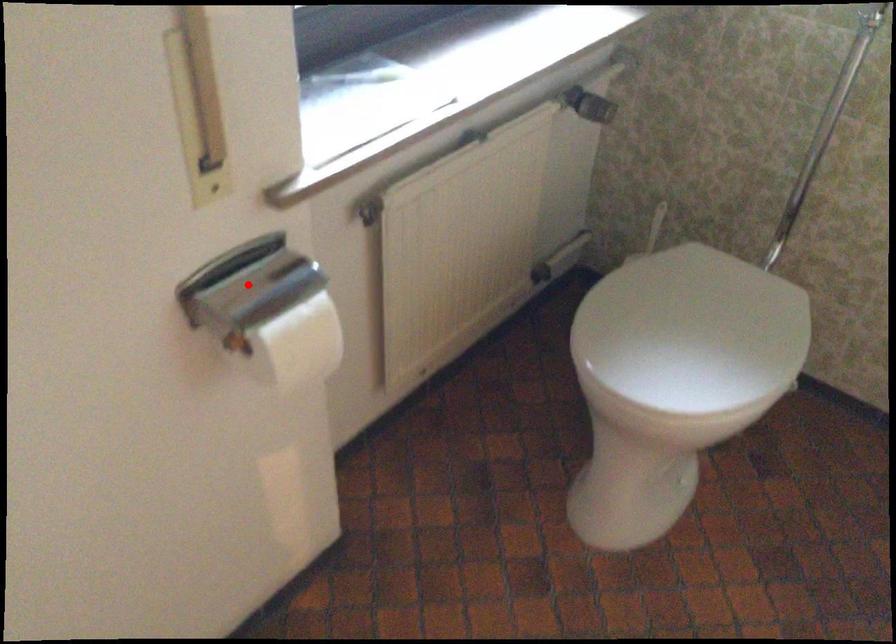
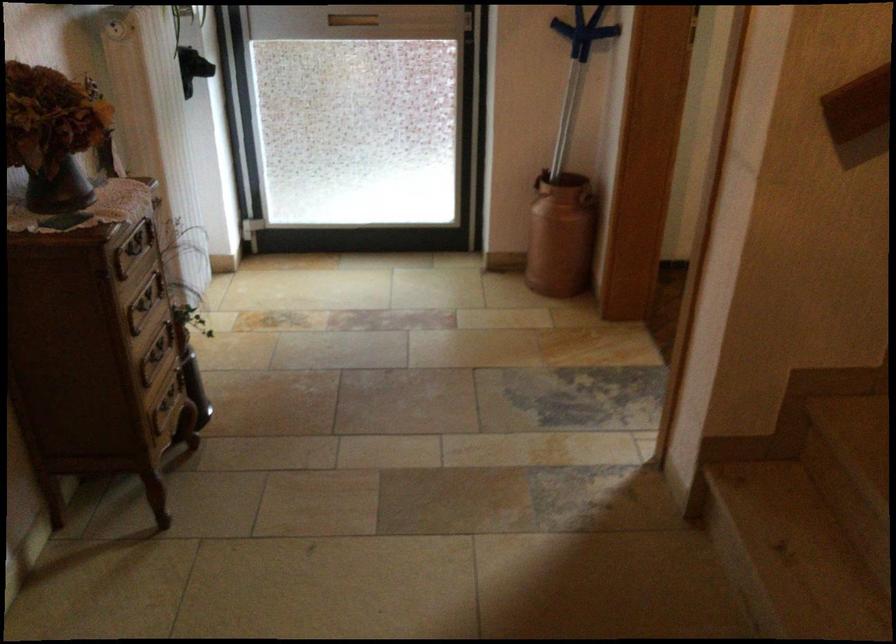
Question: I am providing you with two images of the same scene from different viewpoints. A red point is marked on the first image. Is the red point's position out of view in image 2?

Choices:
 (A) Yes
 (B) No

Answer: (A)